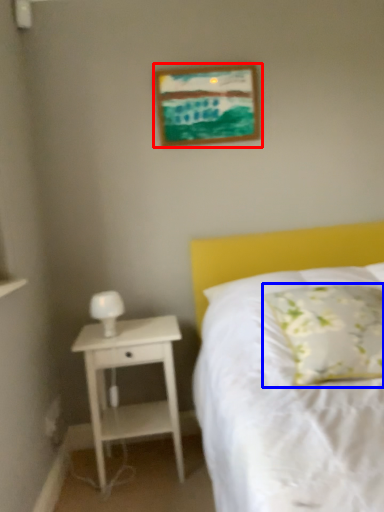
Question: Which object appears closest to the camera in this image, picture frame (highlighted by a red box) or pillow (highlighted by a blue box)?

Choices:
 (A) picture frame
 (B) pillow

Answer: (B)